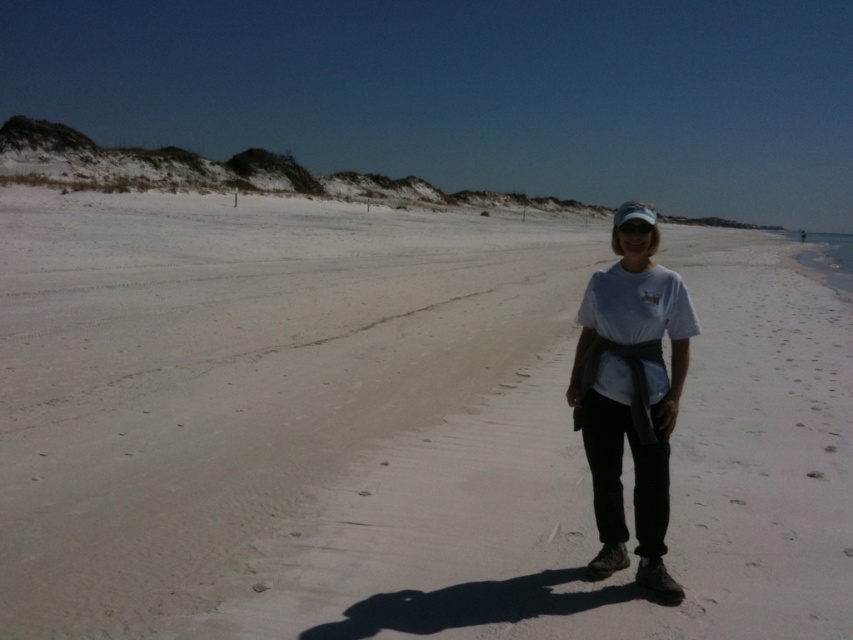
Can you confirm if white sand at center is positioned below white cotton shirt at center?

Actually, white sand at center is above white cotton shirt at center.

Looking at this image, who is positioned more to the right, white sand at center or white cotton shirt at center?

From the viewer's perspective, white sand at center appears more on the right side.

Does point (138, 292) come farther from viewer compared to point (669, 282)?

Yes, it is behind point (669, 282).

The height and width of the screenshot is (640, 853). What are the coordinates of `white sand at center` in the screenshot? It's located at (390, 428).

Can you confirm if white cotton shirt at center is positioned to the right of white fabric baseball hat at center?

No, white cotton shirt at center is not to the right of white fabric baseball hat at center.

In the scene shown: Does white cotton shirt at center appear over white fabric baseball hat at center?

Actually, white cotton shirt at center is below white fabric baseball hat at center.

Between point (584, 419) and point (614, 212), which one is positioned behind?

The point (584, 419) is more distant.

This screenshot has width=853, height=640. What are the coordinates of `white cotton shirt at center` in the screenshot? It's located at (630, 397).

Can you confirm if white sand at center is positioned to the right of white fabric baseball hat at center?

Yes, white sand at center is to the right of white fabric baseball hat at center.

Who is lower down, white sand at center or white fabric baseball hat at center?

white sand at center is lower down.

I want to click on white sand at center, so click(390, 428).

Identify the location of white sand at center. (390, 428).